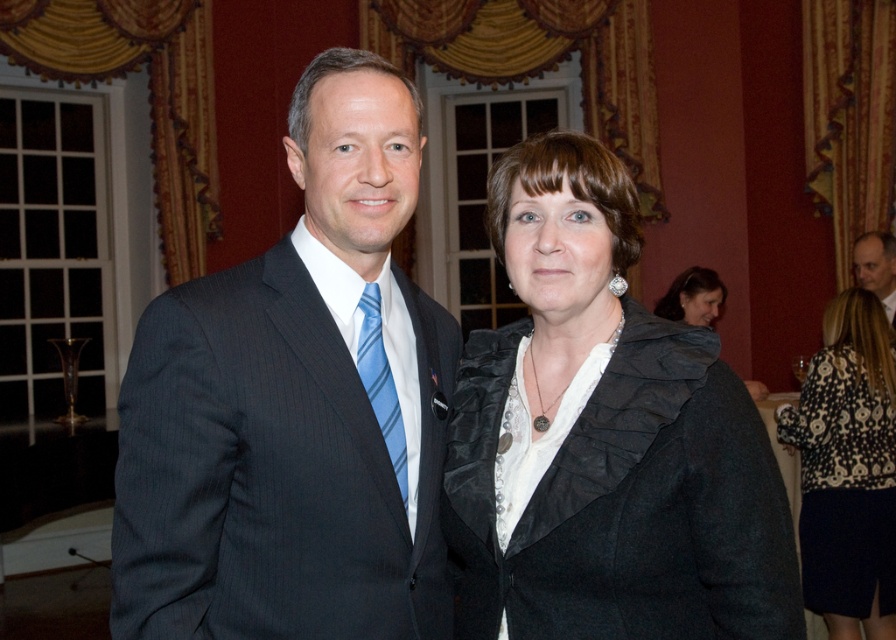
Question: Which object is the farthest from the matte black suit at center?

Choices:
 (A) matte black jacket at center
 (B) black wool coat at center
 (C) blue striped tie at center

Answer: (A)

Question: Is black wool coat at center wider than light brown wood table at upper right?

Choices:
 (A) no
 (B) yes

Answer: (B)

Question: Is black wool coat at center bigger than blue striped tie at center?

Choices:
 (A) no
 (B) yes

Answer: (B)

Question: Which object appears closest to the camera in this image?

Choices:
 (A) matte black suit at center
 (B) light brown wood table at upper right
 (C) matte black jacket at center
 (D) blue striped tie at center

Answer: (A)

Question: Observing the image, what is the correct spatial positioning of black wool coat at center in reference to black printed blouse at lower right?

Choices:
 (A) below
 (B) above

Answer: (B)

Question: Which point appears closest to the camera in this image?

Choices:
 (A) (543, 301)
 (B) (851, 381)
 (C) (212, 355)
 (D) (858, 280)

Answer: (C)